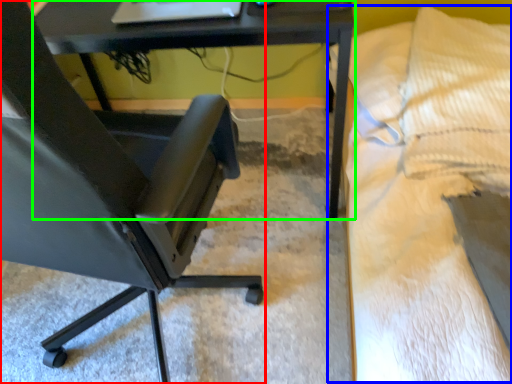
Question: Which is farther away from chair (highlighted by a red box)? bed (highlighted by a blue box) or table (highlighted by a green box)?

Choices:
 (A) bed
 (B) table

Answer: (A)